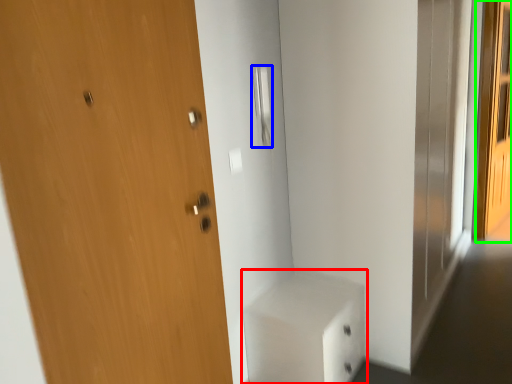
Question: Considering the real-world distances, which object is closest to cabinetry (highlighted by a red box)? door handle (highlighted by a blue box) or screen door (highlighted by a green box).

Choices:
 (A) door handle
 (B) screen door

Answer: (A)